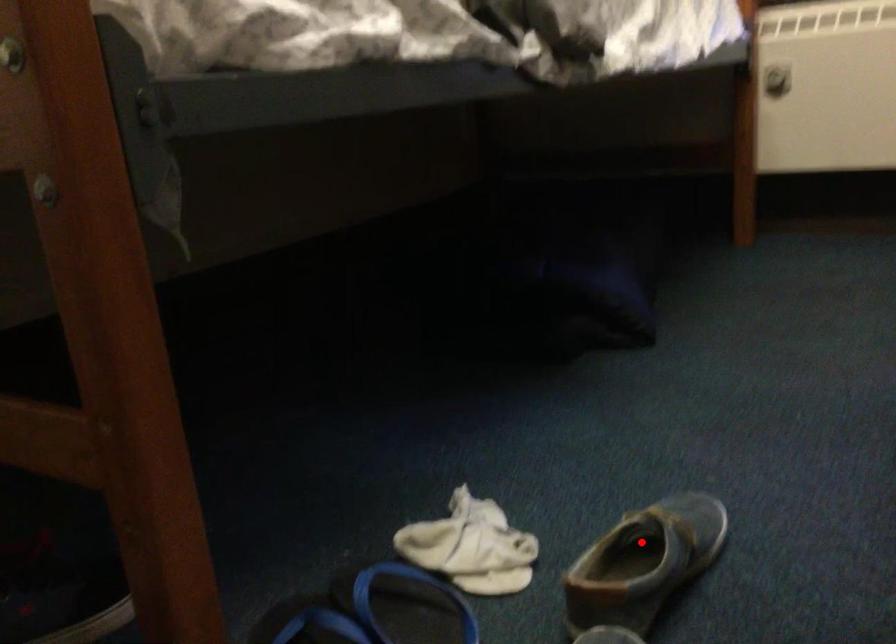
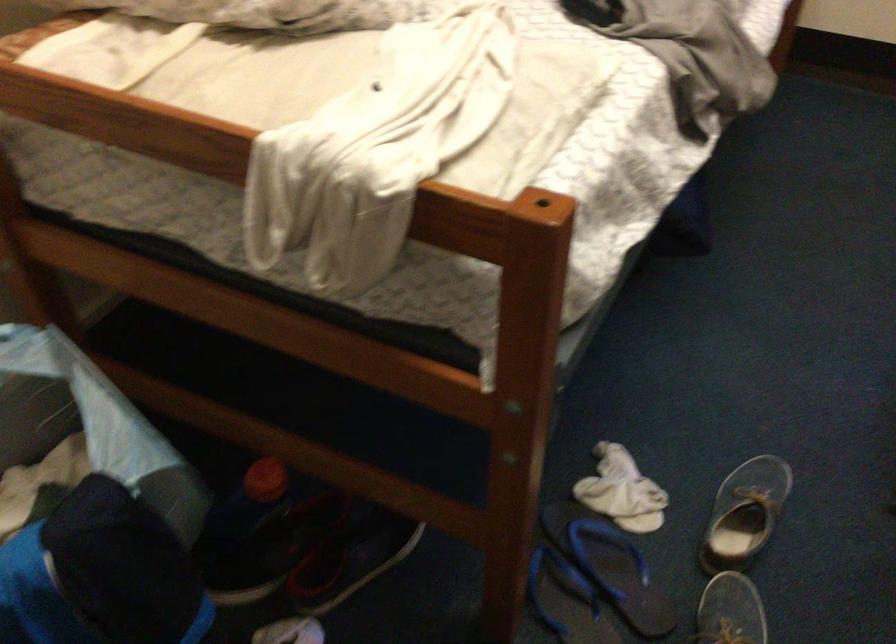
Question: I am providing you with two images of the same scene from different viewpoints. A red point is shown in image1. For the corresponding object point in image2, is it positioned nearer or farther from the camera?

Choices:
 (A) Nearer
 (B) Farther

Answer: (B)